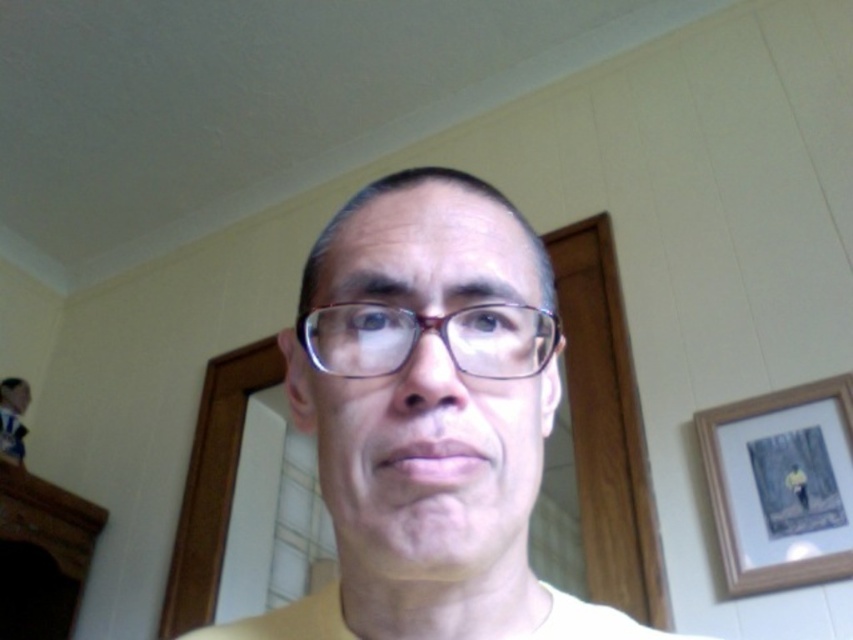
Question: Which object is the closest to the yellow matte t-shirt at center?

Choices:
 (A) matte purple glasses at center
 (B) wooden framed artwork at right

Answer: (A)

Question: Considering the relative positions of wooden framed artwork at right and matte purple glasses at center in the image provided, where is wooden framed artwork at right located with respect to matte purple glasses at center?

Choices:
 (A) left
 (B) right

Answer: (B)

Question: Does wooden framed artwork at right have a greater width compared to yellow matte t-shirt at center?

Choices:
 (A) no
 (B) yes

Answer: (A)

Question: Which point is farther to the camera?

Choices:
 (A) (764, 532)
 (B) (386, 368)
 (C) (338, 589)

Answer: (A)

Question: Which object appears closest to the camera in this image?

Choices:
 (A) yellow matte t-shirt at center
 (B) matte purple glasses at center

Answer: (B)

Question: Does matte yellow shirt at center appear under wooden framed artwork at right?

Choices:
 (A) yes
 (B) no

Answer: (A)